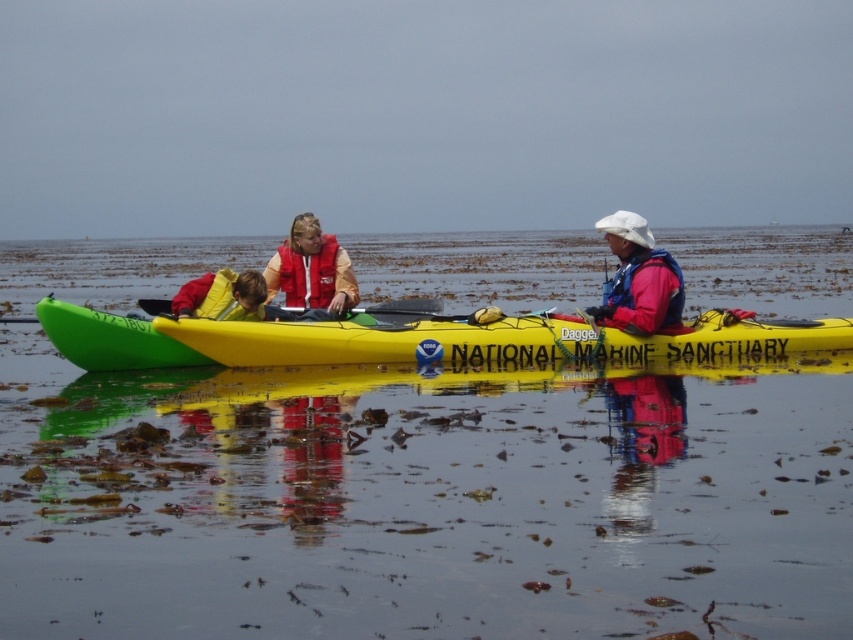
Question: Estimate the real-world distances between objects in this image. Which object is closer to the red life vest at center?

Choices:
 (A) green plastic kayak at center
 (B) yellow life vest at left
 (C) pink fabric jacket at right

Answer: (B)

Question: From the image, what is the correct spatial relationship of green plastic kayak at center in relation to red life vest at center?

Choices:
 (A) below
 (B) above

Answer: (A)

Question: Does red life vest at center appear under matte red life jacket at center?

Choices:
 (A) no
 (B) yes

Answer: (B)

Question: Which object is positioned farthest from the matte red life jacket at center?

Choices:
 (A) red life vest at center
 (B) green plastic kayak at center
 (C) yellow life vest at left
 (D) pink fabric jacket at right

Answer: (B)

Question: Can you confirm if green plastic kayak at center is positioned to the left of pink fabric jacket at right?

Choices:
 (A) yes
 (B) no

Answer: (B)

Question: Which point is farther from the camera taking this photo?

Choices:
 (A) (213, 291)
 (B) (604, 225)
 (C) (550, 323)

Answer: (B)